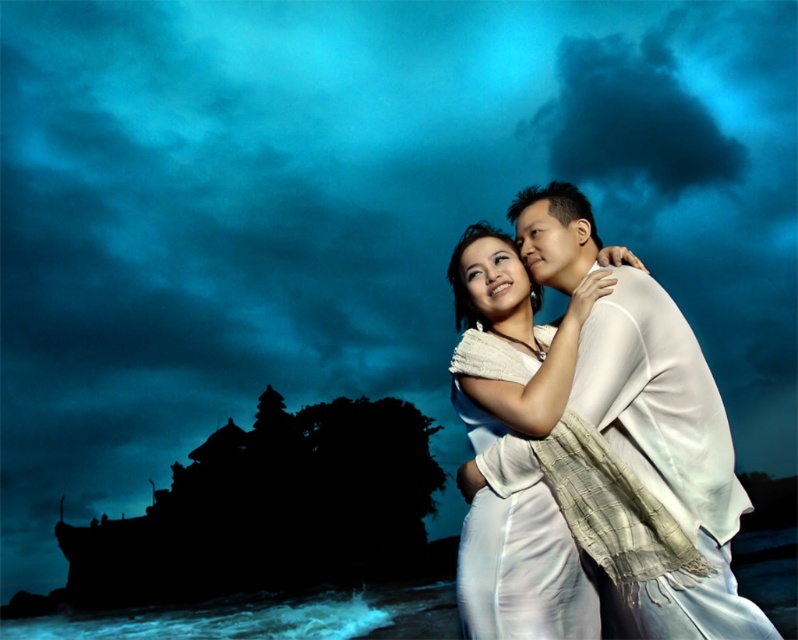
Who is positioned more to the right, white sheer fabric couple at center or white silk dress at center?

white sheer fabric couple at center is more to the right.

Based on the photo, does white sheer fabric couple at center lie in front of white silk dress at center?

Yes, it is in front of white silk dress at center.

Is point (713, 541) positioned after point (546, 589)?

No, it is not.

Where is `white sheer fabric couple at center`? Image resolution: width=798 pixels, height=640 pixels. white sheer fabric couple at center is located at coordinates (587, 444).